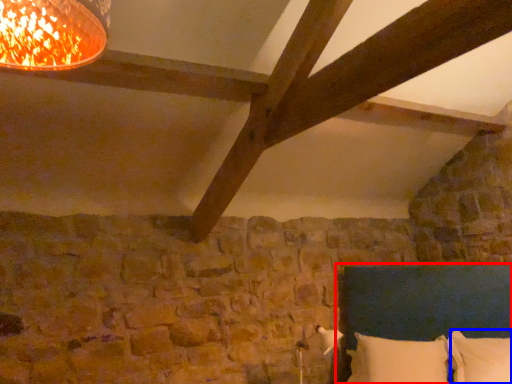
Question: Which point is further to the camera, bed (highlighted by a red box) or pillow (highlighted by a blue box)?

Choices:
 (A) bed
 (B) pillow

Answer: (B)